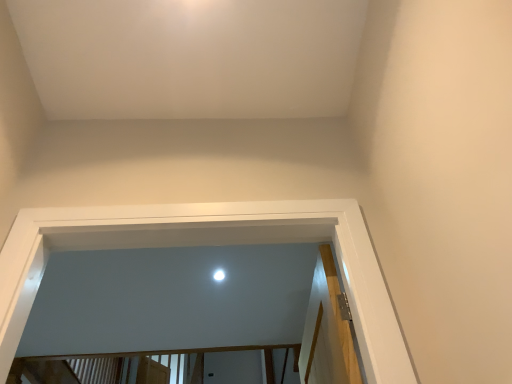
Where is `white matte window at center`? The width and height of the screenshot is (512, 384). white matte window at center is located at coordinates (203, 245).

The height and width of the screenshot is (384, 512). What do you see at coordinates (203, 245) in the screenshot?
I see `white matte window at center` at bounding box center [203, 245].

The height and width of the screenshot is (384, 512). In order to click on white matte window at center in this screenshot , I will do `click(203, 245)`.